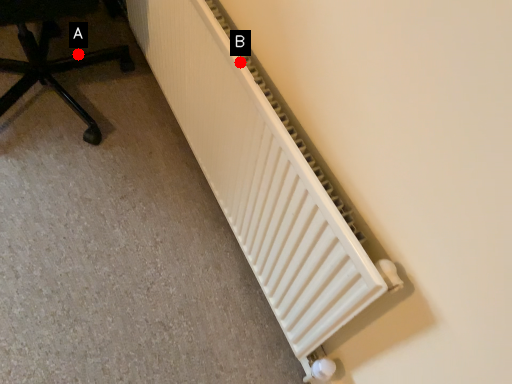
Question: Two points are circled on the image, labeled by A and B beside each circle. Which point is closer to the camera?

Choices:
 (A) A is closer
 (B) B is closer

Answer: (B)